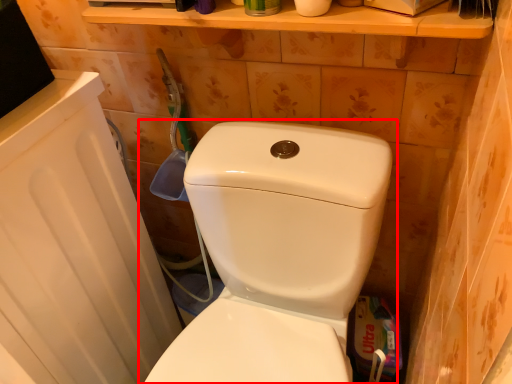
Question: In this image, where is toilet (annotated by the red box) located relative to toilet paper?

Choices:
 (A) right
 (B) left

Answer: (B)